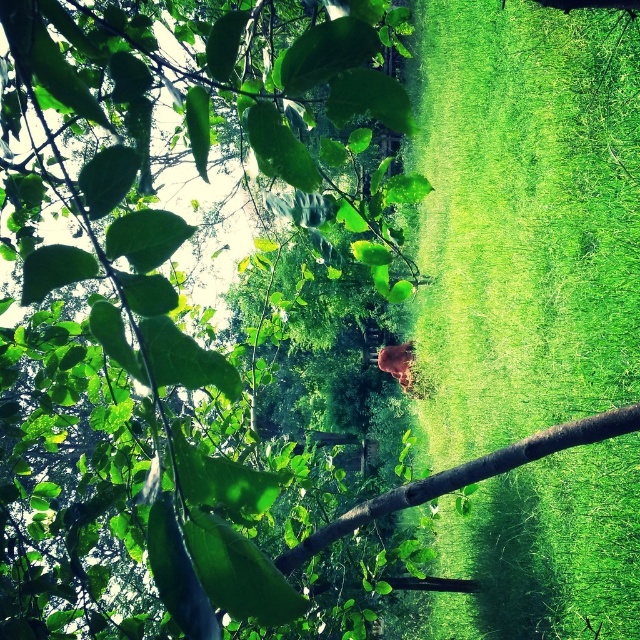
Can you confirm if green grass at center is bigger than brown rough tree branch at center?

Yes.

The image size is (640, 640). What do you see at coordinates (524, 218) in the screenshot?
I see `green grass at center` at bounding box center [524, 218].

Where is `green grass at center`? green grass at center is located at coordinates (524, 218).